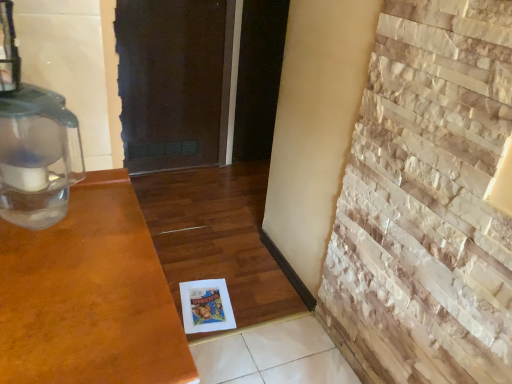
Question: Looking at their shapes, would you say natural stone fireplace at right is wider or thinner than transparent plastic oil lamp at left?

Choices:
 (A) wide
 (B) thin

Answer: (B)

Question: Does point (484, 375) appear closer or farther from the camera than point (11, 92)?

Choices:
 (A) farther
 (B) closer

Answer: (A)

Question: Considering the positions of natural stone fireplace at right and transparent plastic oil lamp at left in the image, is natural stone fireplace at right bigger or smaller than transparent plastic oil lamp at left?

Choices:
 (A) small
 (B) big

Answer: (B)

Question: Is transparent plastic oil lamp at left taller or shorter than natural stone fireplace at right?

Choices:
 (A) short
 (B) tall

Answer: (A)

Question: Relative to natural stone fireplace at right, is transparent plastic oil lamp at left in front or behind?

Choices:
 (A) behind
 (B) front

Answer: (A)

Question: From a real-world perspective, is transparent plastic oil lamp at left positioned above or below natural stone fireplace at right?

Choices:
 (A) above
 (B) below

Answer: (A)

Question: In terms of size, does transparent plastic oil lamp at left appear bigger or smaller than natural stone fireplace at right?

Choices:
 (A) big
 (B) small

Answer: (B)